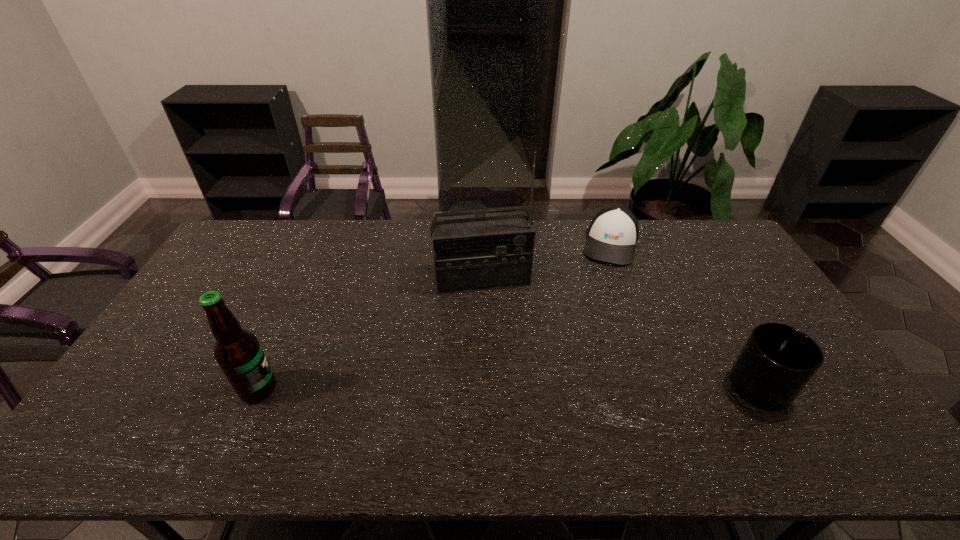
Identify the location of vacant space on the desktop that is between the leftmost object and the third tallest object and is positioned on the front panel of the tallest object. (506, 388).

This screenshot has height=540, width=960. What are the coordinates of `vacant spot on the desktop that is between the leftmost object and the third tallest object and is positioned on the front panel of the shortest object` in the screenshot? It's located at (578, 387).